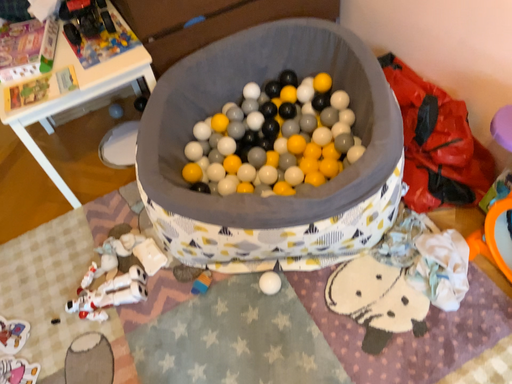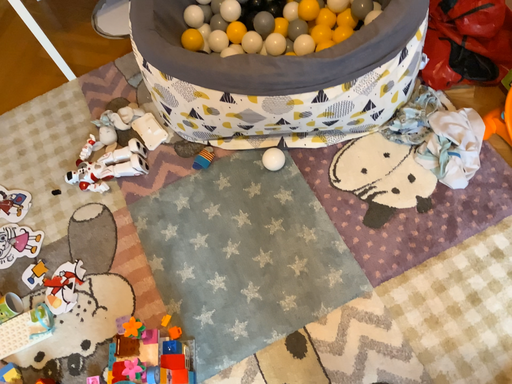
Question: How did the camera likely rotate when shooting the video?

Choices:
 (A) rotated downward
 (B) rotated upward

Answer: (A)